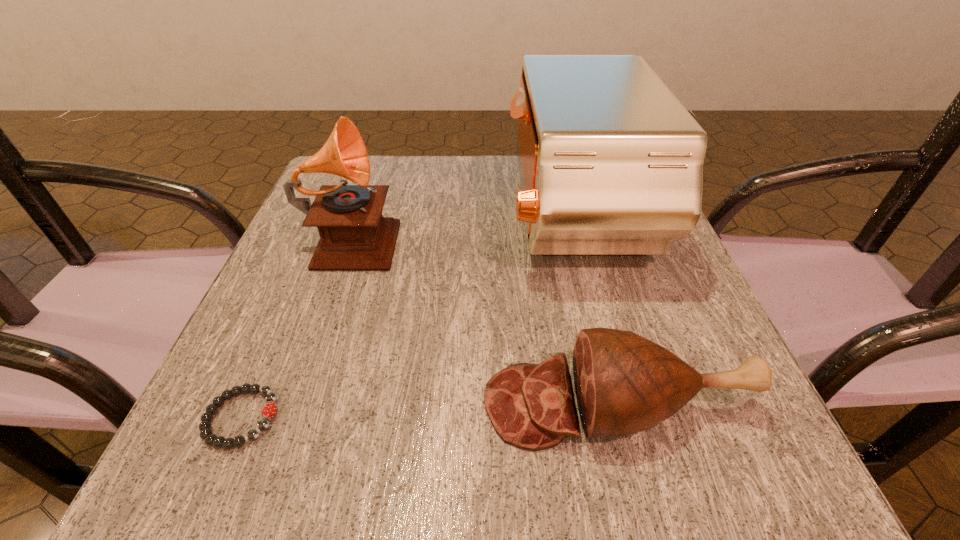
Where is `free spot that satisfies the following two spatial constraints: 1. at the sliced end of the ham; 2. on the front side of the shortest object`? free spot that satisfies the following two spatial constraints: 1. at the sliced end of the ham; 2. on the front side of the shortest object is located at coordinates (620, 418).